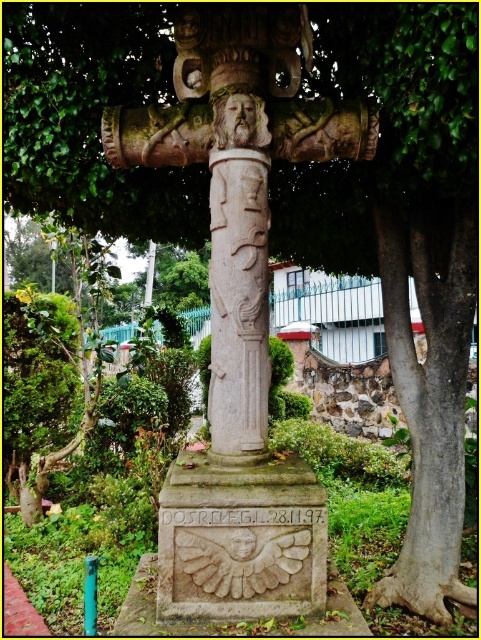
You are standing at the base of the monument and want to take a photo that includes both the point at coordinates point (219, 321) and point (243, 260). Which point should you position closer to the camera to ensure both are in focus?

Since point (219, 321) is behind point (243, 260), you should position the camera closer to point (243, 260) to ensure both points are in focus as they will be within the depth of field.

You are an architect designing a garden layout and need to place both the carved stone column at center and the white stone column at center. Given their sizes, which one should be placed closer to the entrance to ensure visibility?

The carved stone column at center is larger in size than the white stone column at center, so placing the larger carved stone column closer to the entrance will ensure it is more visible from a distance.

You are standing in front of a monument and see both the carved stone column at center and the white stone column at center. Which one is located to the right?

The carved stone column at center is positioned on the right side of the white stone column at center.